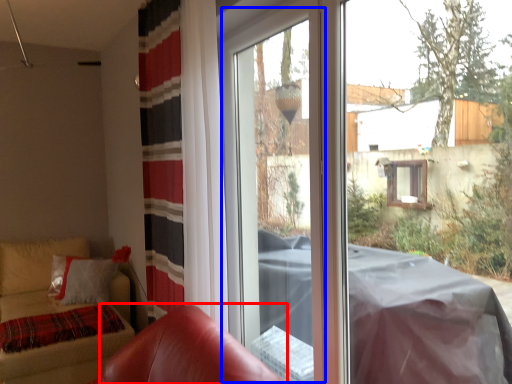
Question: Which of the following is the farthest to the observer, armchair (highlighted by a red box) or screen door (highlighted by a blue box)?

Choices:
 (A) armchair
 (B) screen door

Answer: (B)